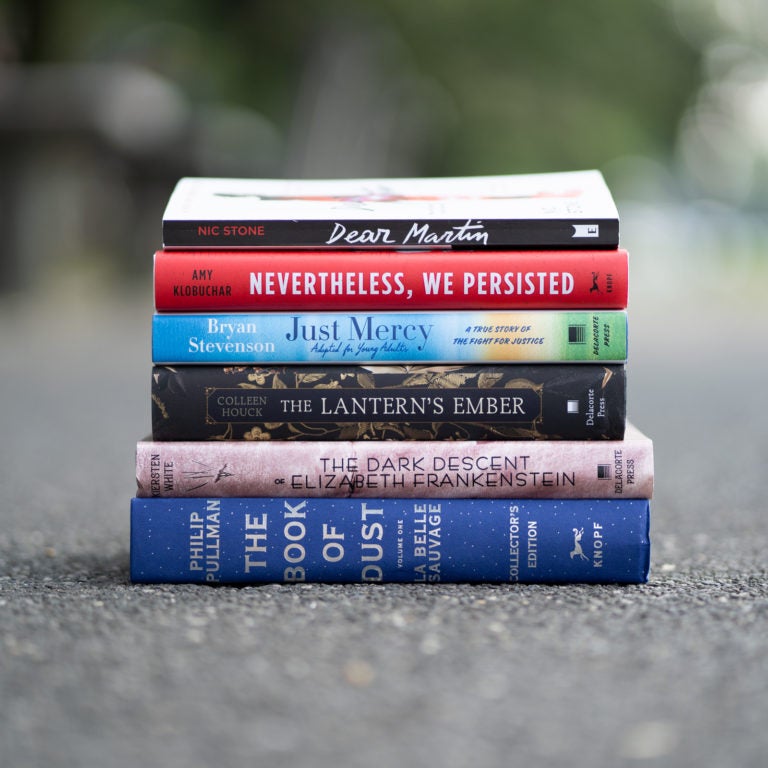
Identify the location of books. (293, 518), (336, 458), (429, 288), (462, 234), (381, 355), (421, 396).